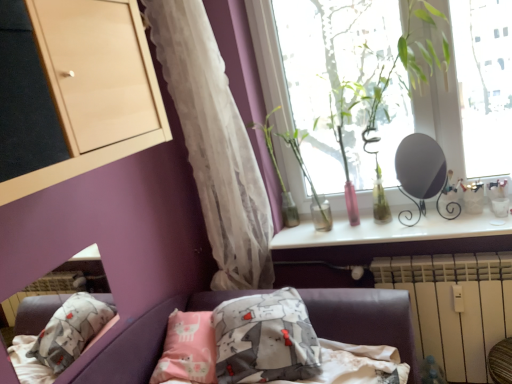
The height and width of the screenshot is (384, 512). In order to click on vacant region below green glass vase at upper center, arranged as the 2th plant when viewed from the left (from a real-world perspective) in this screenshot , I will do `click(312, 228)`.